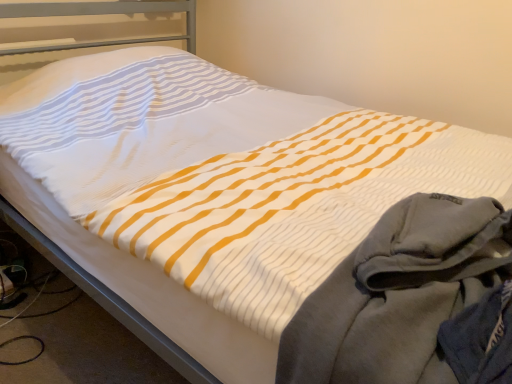
Identify the location of gray fleece pants at lower right. (411, 301).

The image size is (512, 384). Describe the element at coordinates (411, 301) in the screenshot. I see `gray fleece pants at lower right` at that location.

Find the location of a particular element. This screenshot has width=512, height=384. gray fleece pants at lower right is located at coordinates (411, 301).